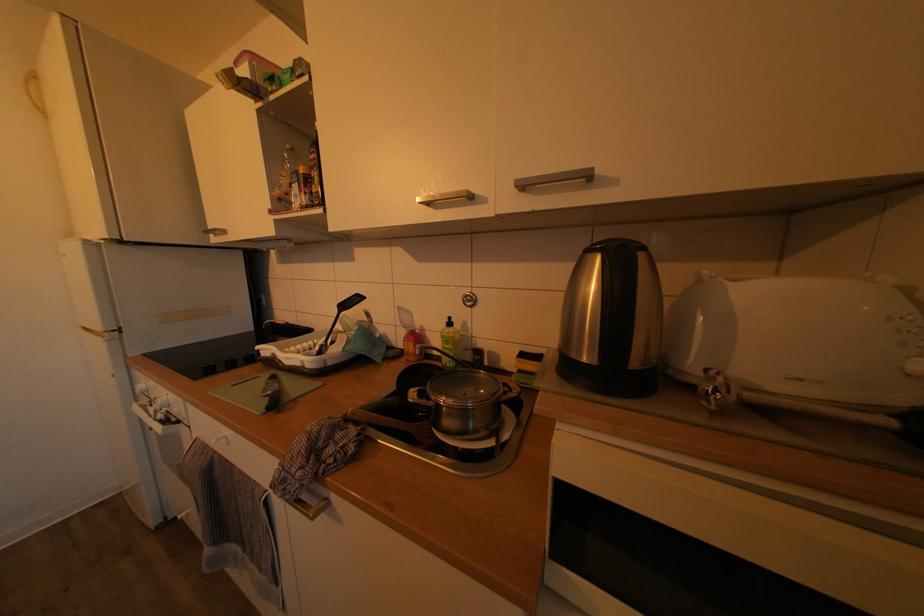
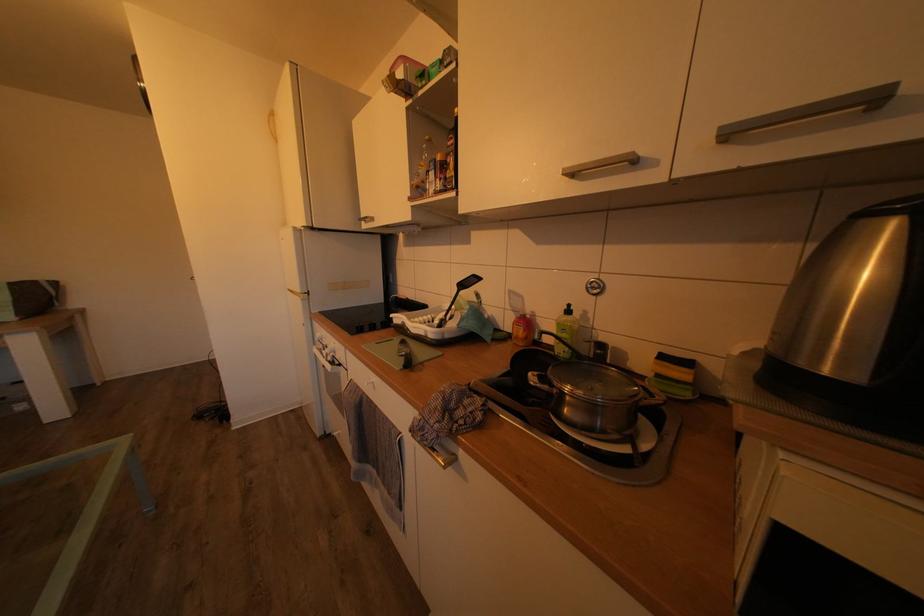
The point at (457, 330) is marked in the first image. Where is the corresponding point in the second image?

(577, 317)